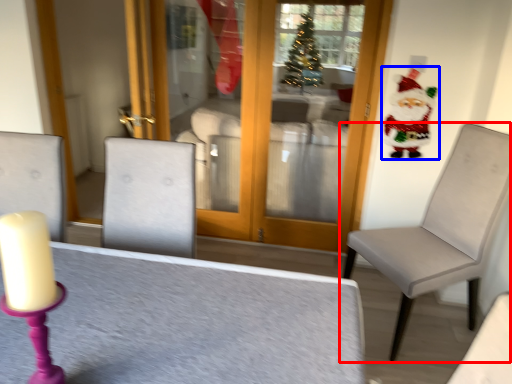
Question: Which object appears farthest to the camera in this image, chair (highlighted by a red box) or santa claus (highlighted by a blue box)?

Choices:
 (A) chair
 (B) santa claus

Answer: (B)